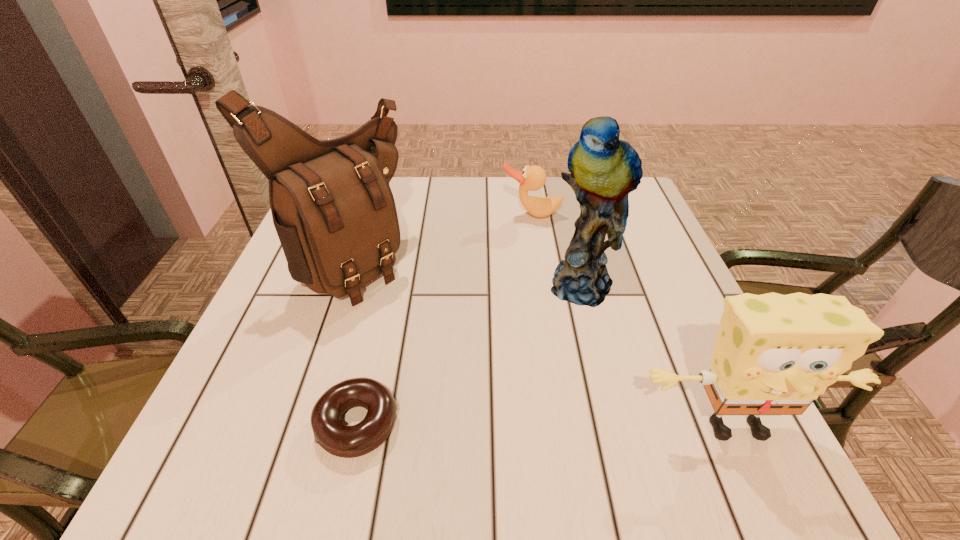
Locate an element on the screen. Image resolution: width=960 pixels, height=540 pixels. vacant space situated on the beak of the second shortest object is located at coordinates (528, 241).

What are the coordinates of `vacant space located 0.110m on the beak of the second shortest object` in the screenshot? It's located at (528, 248).

The width and height of the screenshot is (960, 540). Identify the location of vacant region located on the face of the parrot. (581, 393).

Locate an element on the screen. The width and height of the screenshot is (960, 540). free space located 0.200m on the face of the parrot is located at coordinates (581, 398).

The image size is (960, 540). Find the location of `vacant space located on the face of the parrot`. vacant space located on the face of the parrot is located at coordinates (580, 414).

Image resolution: width=960 pixels, height=540 pixels. Find the location of `shoulder bag positioned at the far edge`. shoulder bag positioned at the far edge is located at coordinates (334, 212).

Image resolution: width=960 pixels, height=540 pixels. Find the location of `duck present at the far edge`. duck present at the far edge is located at coordinates (533, 178).

Image resolution: width=960 pixels, height=540 pixels. Find the location of `doughnut situated at the near edge`. doughnut situated at the near edge is located at coordinates (330, 433).

Where is `sponge present at the near edge`? The image size is (960, 540). sponge present at the near edge is located at coordinates (775, 354).

What are the coordinates of `object located in the left edge section of the desktop` in the screenshot? It's located at (334, 212).